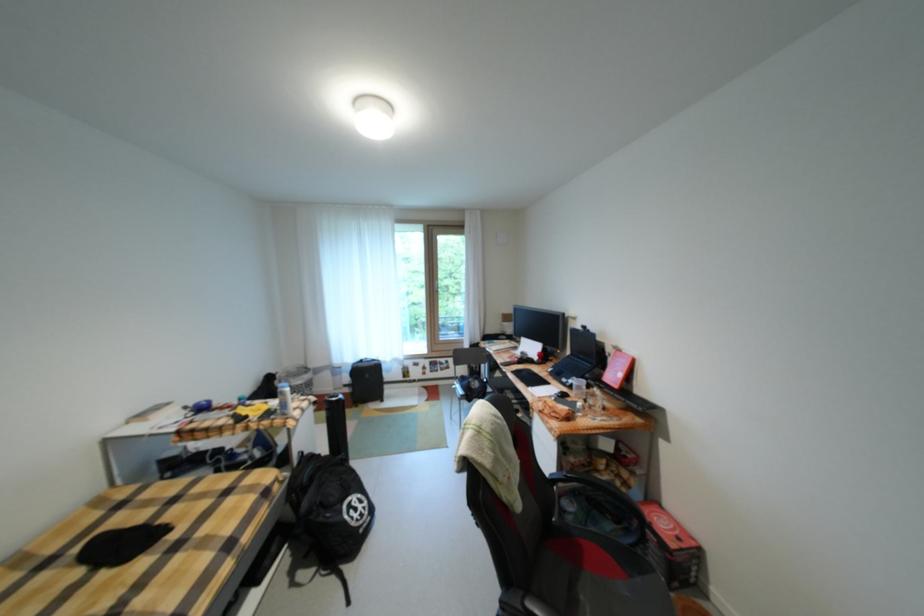
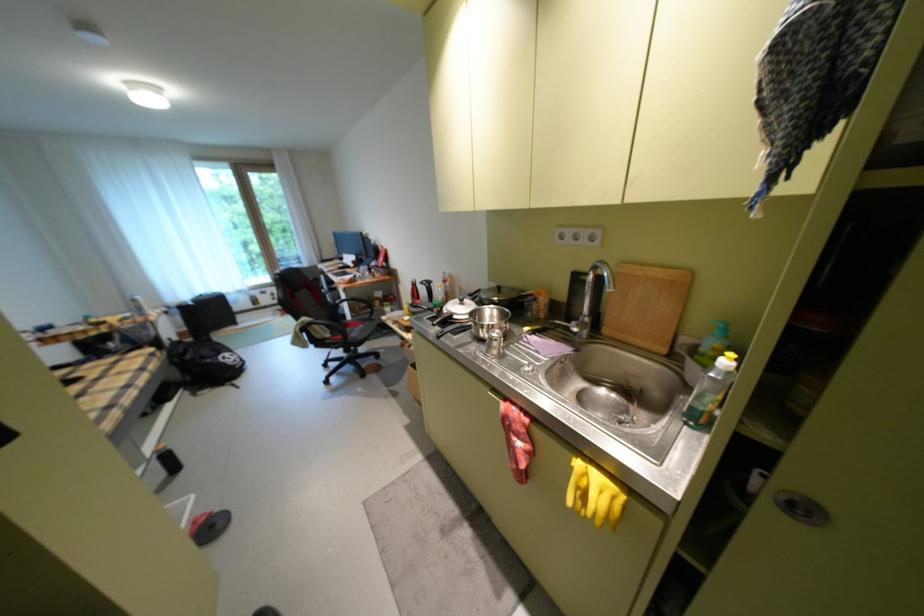
Locate, in the second image, the point that corresponds to [432,367] in the first image.

(280, 294)